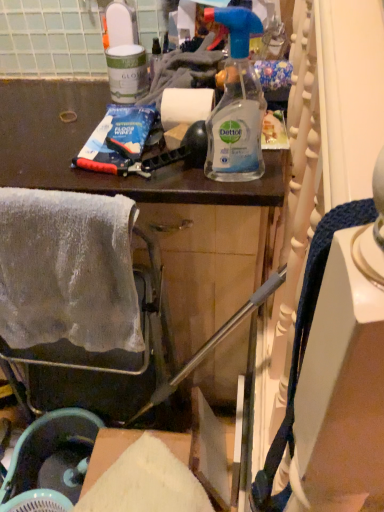
In order to click on free location to the left of white glossy paint can at upper left, which is the second bottle in front-to-back order in this screenshot , I will do `click(43, 113)`.